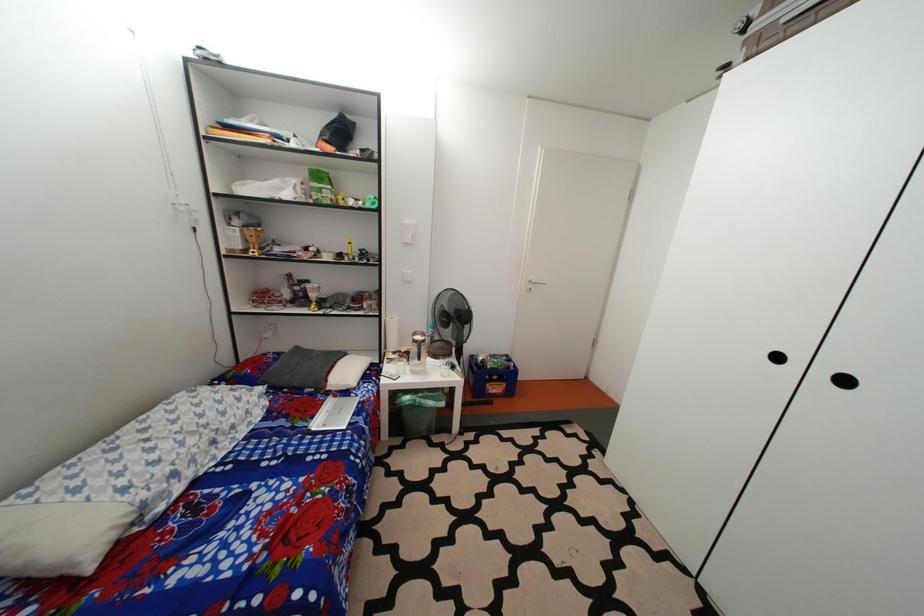
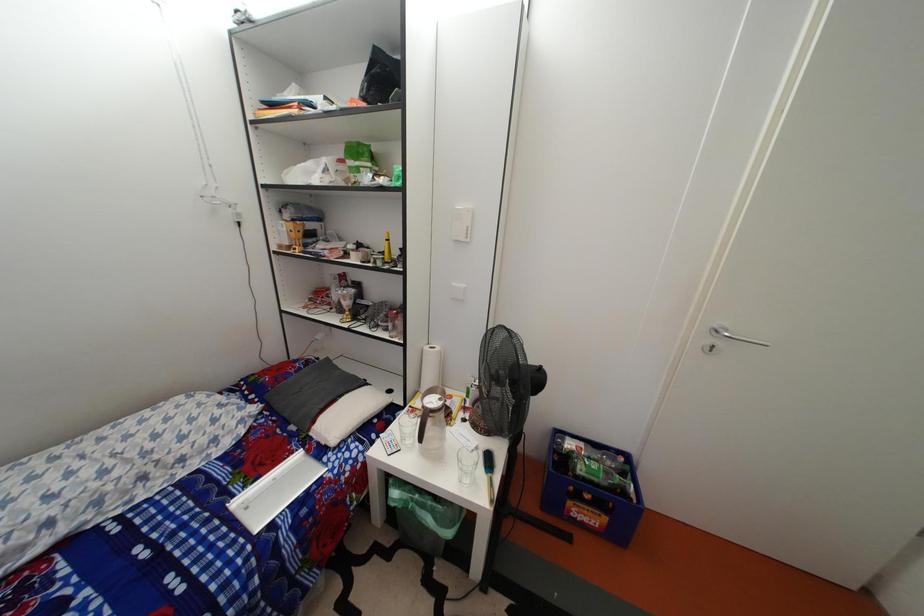
Question: The first image is from the beginning of the video and the second image is from the end. How did the camera likely rotate when shooting the video?

Choices:
 (A) Left
 (B) Right
 (C) Up
 (D) Down

Answer: (A)